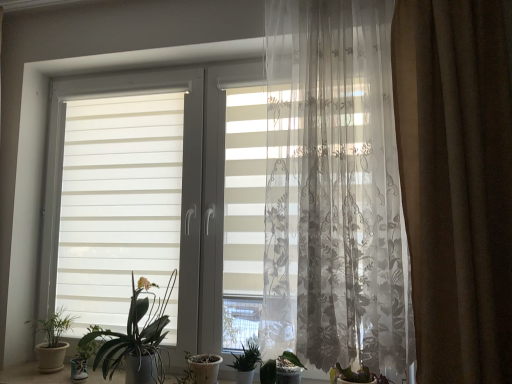
Question: From a real-world perspective, is green matte leafy plant at lower center, marked as the fourth houseplant in a left-to-right arrangement, physically above white striped window at center?

Choices:
 (A) no
 (B) yes

Answer: (A)

Question: Considering the relative sizes of green matte leafy plant at lower center, the 1th houseplant from the right, and white striped window at center in the image provided, is green matte leafy plant at lower center, the 1th houseplant from the right, shorter than white striped window at center?

Choices:
 (A) no
 (B) yes

Answer: (B)

Question: Could you tell me if green matte leafy plant at lower center, marked as the fourth houseplant in a left-to-right arrangement, is turned towards white striped window at center?

Choices:
 (A) yes
 (B) no

Answer: (B)

Question: Is green matte leafy plant at lower center, marked as the fourth houseplant in a left-to-right arrangement, further to camera compared to white striped window at center?

Choices:
 (A) yes
 (B) no

Answer: (B)

Question: Is white striped window at center at the back of green matte leafy plant at lower center, marked as the fourth houseplant in a left-to-right arrangement?

Choices:
 (A) yes
 (B) no

Answer: (A)

Question: From the image's perspective, is green matte leafy plant at lower center, marked as the fourth houseplant in a left-to-right arrangement, located above or below green leafy plant at center, acting as the second houseplant starting from the right?

Choices:
 (A) below
 (B) above

Answer: (A)

Question: Considering the positions of green matte leafy plant at lower center, marked as the fourth houseplant in a left-to-right arrangement, and green leafy plant at center, which is the 3th houseplant in left-to-right order, in the image, is green matte leafy plant at lower center, marked as the fourth houseplant in a left-to-right arrangement, taller or shorter than green leafy plant at center, which is the 3th houseplant in left-to-right order,?

Choices:
 (A) short
 (B) tall

Answer: (A)

Question: Is green matte leafy plant at lower center, marked as the fourth houseplant in a left-to-right arrangement, in front of or behind green leafy plant at center, which is the 3th houseplant in left-to-right order, in the image?

Choices:
 (A) front
 (B) behind

Answer: (A)

Question: Which is correct: green matte leafy plant at lower center, marked as the fourth houseplant in a left-to-right arrangement, is inside green leafy plant at center, acting as the second houseplant starting from the right, or outside of it?

Choices:
 (A) outside
 (B) inside

Answer: (A)

Question: Which is correct: brown velvet curtain at right, the first curtain positioned from the right, is inside sheer floral-patterned curtain at center, acting as the second curtain starting from the right, or outside of it?

Choices:
 (A) outside
 (B) inside

Answer: (A)

Question: From a real-world perspective, is brown velvet curtain at right, the first curtain positioned from the right, above or below sheer floral-patterned curtain at center, acting as the second curtain starting from the right?

Choices:
 (A) above
 (B) below

Answer: (B)

Question: From the image's perspective, relative to sheer floral-patterned curtain at center, positioned as the 1th curtain in left-to-right order, is brown velvet curtain at right, the first curtain positioned from the right, above or below?

Choices:
 (A) below
 (B) above

Answer: (A)

Question: Is brown velvet curtain at right, which appears as the 2th curtain when viewed from the left, to the left or to the right of sheer floral-patterned curtain at center, positioned as the 1th curtain in left-to-right order, in the image?

Choices:
 (A) right
 (B) left

Answer: (A)

Question: From a real-world perspective, is green matte plant at lower left, placed as the 4th houseplant when sorted from right to left, positioned above or below green matte plant at center, the 3th houseplant positioned from the right?

Choices:
 (A) below
 (B) above

Answer: (A)

Question: Considering the positions of green matte plant at lower left, placed as the 4th houseplant when sorted from right to left, and green matte plant at center, the 2th houseplant viewed from the left, in the image, is green matte plant at lower left, placed as the 4th houseplant when sorted from right to left, taller or shorter than green matte plant at center, the 2th houseplant viewed from the left,?

Choices:
 (A) short
 (B) tall

Answer: (A)